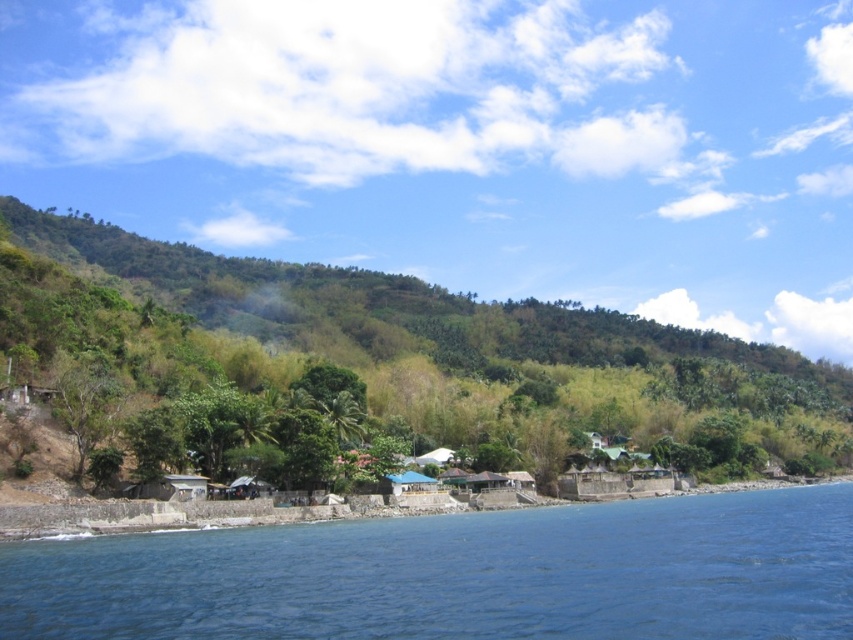
Question: Which of the following is the farthest from the observer?

Choices:
 (A) (345, 554)
 (B) (271, 304)

Answer: (B)

Question: Which of the following is the farthest from the observer?

Choices:
 (A) blue water at lower left
 (B) green leafy hillside at center

Answer: (B)

Question: Is blue water at lower left positioned in front of green leafy hillside at center?

Choices:
 (A) no
 (B) yes

Answer: (B)

Question: Does blue water at lower left appear on the right side of green leafy hillside at center?

Choices:
 (A) no
 (B) yes

Answer: (A)

Question: Does blue water at lower left appear under green leafy hillside at center?

Choices:
 (A) no
 (B) yes

Answer: (B)